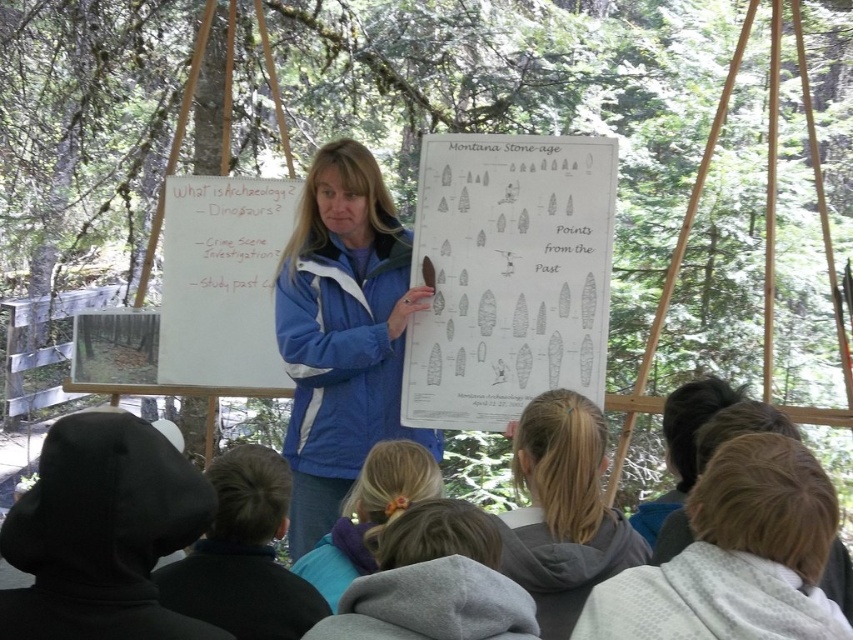
Between white paper at center and light blue hoodie at lower center, which one is positioned higher?

Positioned higher is white paper at center.

Can you confirm if white paper at center is smaller than light blue hoodie at lower center?

Incorrect, white paper at center is not smaller in size than light blue hoodie at lower center.

You are a GUI agent. You are given a task and a screenshot of the screen. Output one action in this format:
    pyautogui.click(x=<x>, y=<y>)
    Task: Click on the white paper at center
    Image resolution: width=853 pixels, height=640 pixels.
    Given the screenshot: What is the action you would take?
    pyautogui.click(x=508, y=275)

At what (x,y) coordinates should I click in order to perform the action: click on white paper at center. Please return your answer as a coordinate pair (x, y). Looking at the image, I should click on (508, 275).

Does blue fabric jacket at center appear on the right side of whiteboard at upper left?

Yes, blue fabric jacket at center is to the right of whiteboard at upper left.

Which of these two, blue fabric jacket at center or whiteboard at upper left, stands shorter?

A: With less height is whiteboard at upper left.

This screenshot has height=640, width=853. In order to click on blue fabric jacket at center in this screenshot , I will do `click(341, 333)`.

Does blue fabric jacket at center have a lesser width compared to light brown hair at lower right?

No, blue fabric jacket at center is not thinner than light brown hair at lower right.

Is blue fabric jacket at center smaller than light brown hair at lower right?

Actually, blue fabric jacket at center might be larger than light brown hair at lower right.

Between point (318, 365) and point (727, 627), which one is positioned behind?

The point (318, 365) is behind.

I want to click on blue fabric jacket at center, so click(x=341, y=333).